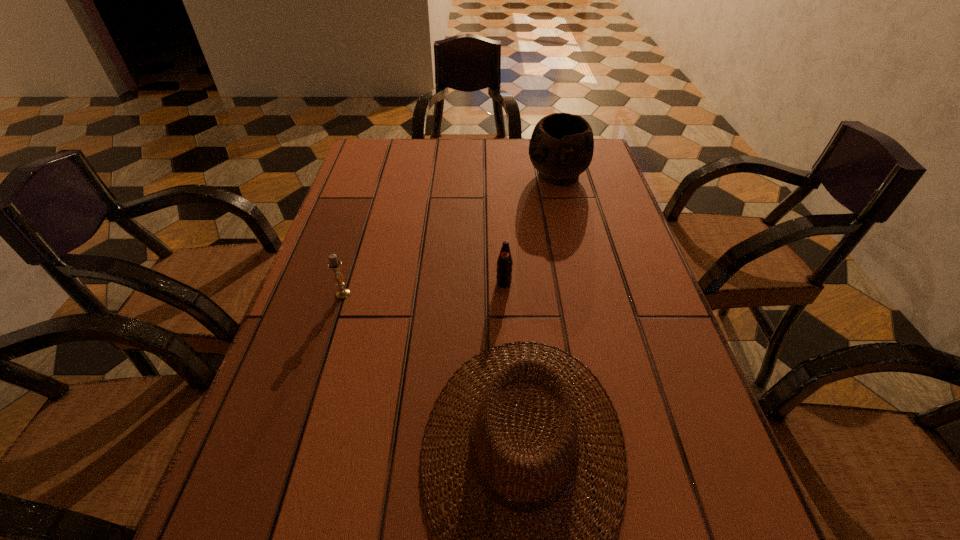
Where is `empty space that is in between the second farthest object and the second nearest object`? empty space that is in between the second farthest object and the second nearest object is located at coordinates (423, 288).

The height and width of the screenshot is (540, 960). In order to click on free spot between the farthest object and the pop in this screenshot , I will do `click(531, 230)`.

Find the location of `the third closest object to the leftmost object`. the third closest object to the leftmost object is located at coordinates (561, 147).

Locate which object is the second closest to the third nearest object. Please provide its 2D coordinates. Your answer should be formatted as a tuple, i.e. [(x, y)], where the tuple contains the x and y coordinates of a point satisfying the conditions above.

[(333, 264)]